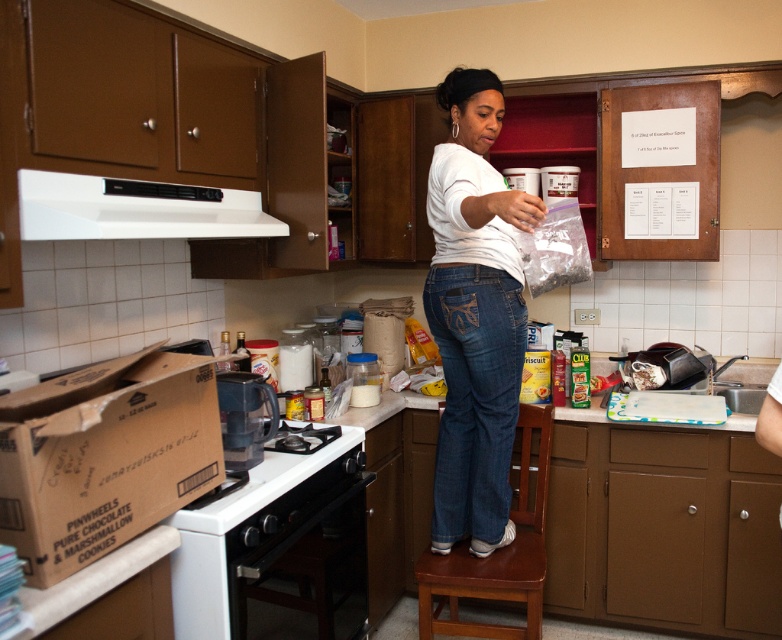
Question: Which object is positioned closest to the brown wooden step stool at center?

Choices:
 (A) white cotton shirt at center
 (B) white matte exhaust hood at upper center

Answer: (A)

Question: Where is white matte exhaust hood at upper center located in relation to brown wooden step stool at center in the image?

Choices:
 (A) above
 (B) below

Answer: (A)

Question: Which point appears closest to the camera in this image?

Choices:
 (A) (83, 403)
 (B) (454, 586)
 (C) (127, 196)
 (D) (508, 232)

Answer: (A)

Question: Does white cotton shirt at center have a greater width compared to brown wooden step stool at center?

Choices:
 (A) no
 (B) yes

Answer: (A)

Question: Can you confirm if white matte exhaust hood at upper center is thinner than brown wooden step stool at center?

Choices:
 (A) no
 (B) yes

Answer: (B)

Question: Which point is farther to the camera?

Choices:
 (A) (474, 292)
 (B) (49, 476)

Answer: (A)